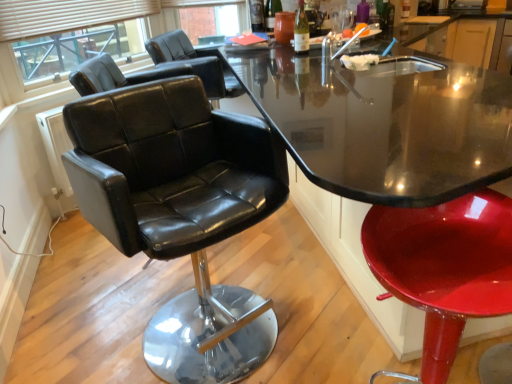
Question: From a real-world perspective, is black leather chair at left, which is the second chair from front to back, under glossy red stool at lower right, which is counted as the third chair, starting from the back?

Choices:
 (A) no
 (B) yes

Answer: (A)

Question: Considering the relative sizes of black leather chair at left, which is counted as the second chair, starting from the back, and glossy red stool at lower right, which is counted as the third chair, starting from the back, in the image provided, is black leather chair at left, which is counted as the second chair, starting from the back, shorter than glossy red stool at lower right, which is counted as the third chair, starting from the back,?

Choices:
 (A) yes
 (B) no

Answer: (B)

Question: Is black leather chair at left, which is counted as the second chair, starting from the back, surrounding glossy red stool at lower right, the 1th chair when ordered from front to back?

Choices:
 (A) no
 (B) yes

Answer: (A)

Question: Is black leather chair at left, which is counted as the second chair, starting from the back, at the right side of glossy red stool at lower right, the 1th chair when ordered from front to back?

Choices:
 (A) yes
 (B) no

Answer: (B)

Question: Can you confirm if black leather chair at left, which is counted as the second chair, starting from the back, is positioned to the left of glossy red stool at lower right, the 1th chair when ordered from front to back?

Choices:
 (A) yes
 (B) no

Answer: (A)

Question: Considering the positions of point (444, 240) and point (295, 43), is point (444, 240) closer or farther from the camera than point (295, 43)?

Choices:
 (A) closer
 (B) farther

Answer: (A)

Question: Is glossy red stool at lower right, the 1th chair when ordered from front to back, bigger or smaller than white glass bottle at upper center?

Choices:
 (A) small
 (B) big

Answer: (B)

Question: Visually, is glossy red stool at lower right, the 1th chair when ordered from front to back, positioned to the left or to the right of white glass bottle at upper center?

Choices:
 (A) left
 (B) right

Answer: (B)

Question: From the image's perspective, is glossy red stool at lower right, the 1th chair when ordered from front to back, located above or below white glass bottle at upper center?

Choices:
 (A) above
 (B) below

Answer: (B)

Question: Visually, is glossy black table at center positioned to the left or to the right of black leather chairs at upper left?

Choices:
 (A) left
 (B) right

Answer: (B)

Question: From the image's perspective, relative to black leather chairs at upper left, is glossy black table at center above or below?

Choices:
 (A) below
 (B) above

Answer: (A)

Question: In terms of height, does glossy black table at center look taller or shorter compared to black leather chairs at upper left?

Choices:
 (A) tall
 (B) short

Answer: (A)

Question: Based on their sizes in the image, would you say glossy black table at center is bigger or smaller than black leather chairs at upper left?

Choices:
 (A) big
 (B) small

Answer: (A)

Question: Is black leather chair at center, placed as the third chair when sorted from front to back, wider or thinner than white glass bottle at upper center?

Choices:
 (A) thin
 (B) wide

Answer: (B)

Question: From the image's perspective, is black leather chair at center, which ranks as the first chair in back-to-front order, above or below white glass bottle at upper center?

Choices:
 (A) below
 (B) above

Answer: (A)